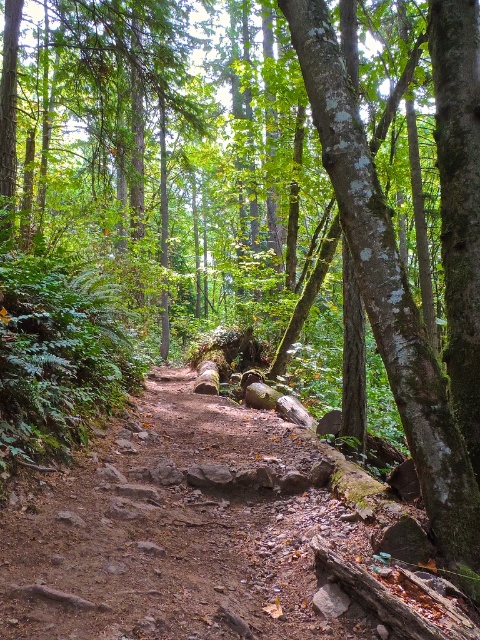
Based on the photo, is dirt path at center positioned at the back of green mossy tree trunk at right?

No, dirt path at center is closer to the viewer.

Who is shorter, dirt path at center or green mossy tree trunk at right?

Standing shorter between the two is dirt path at center.

What do you see at coordinates (216, 536) in the screenshot? I see `dirt path at center` at bounding box center [216, 536].

The width and height of the screenshot is (480, 640). In order to click on dirt path at center in this screenshot , I will do `click(216, 536)`.